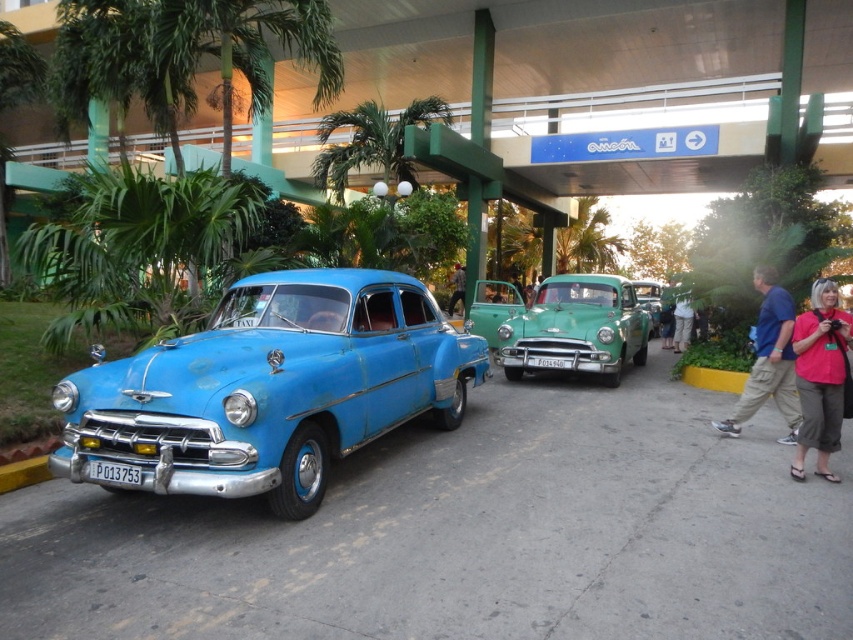
You are a visitor at a vintage car exhibition and notice the green glossy car at center and the light brown leather jacket at center. Which object is located above the other?

The green glossy car at center is positioned under the light brown leather jacket at center, so the light brown leather jacket at center is above the green glossy car at center.

You are standing in front of two vintage cars parked side by side under a covered structure. You notice two points marked on the ground at coordinates point (518, 336) and point (451, 300). If you want to place a small flag exactly halfway between these two points, where should you place it?

To place the flag halfway between point (518, 336) and point (451, 300), calculate the midpoint by averaging the coordinates. The midpoint would be at coordinates point 0.497, 0.569.